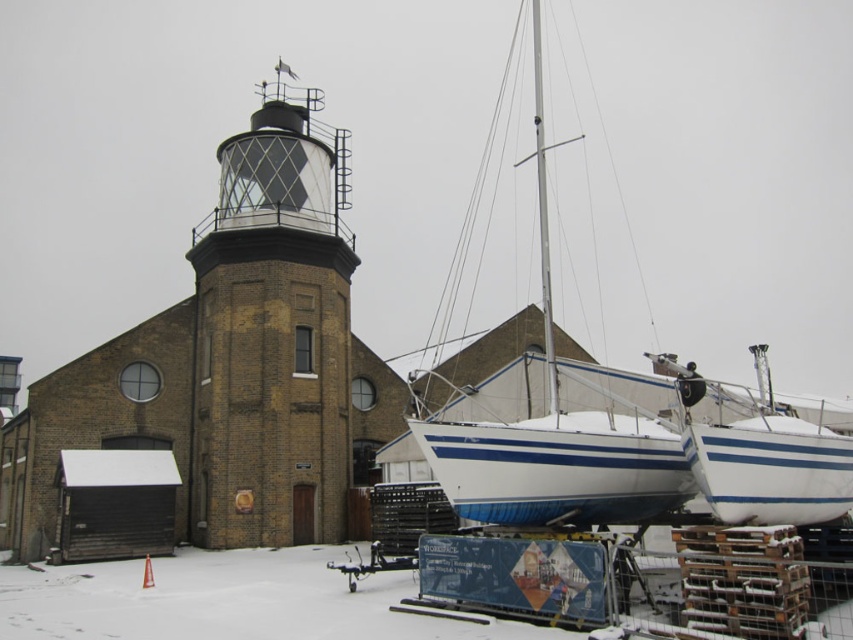
You are standing in front of the historic brick building with the lighthouse on top. You notice two points marked on the ground in front of you. The first point is at coordinates point (308, 234) and the second is at point (506, 465). If you were to walk towards both points, which point would you reach first?

Point (308, 234) is further to the viewer than point (506, 465), so you would reach point (308, 234) first.

You are standing at the point marked as point [271,333] in the snowy outdoor scene. What object is exactly at your current location?

The matte black lighthouse at center is exactly at point [271,333].